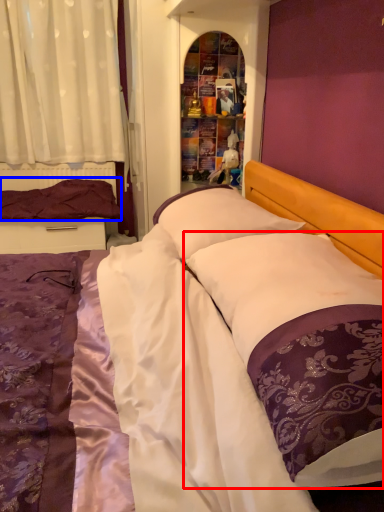
Question: Which point is closer to the camera, pillow (highlighted by a red box) or pillow (highlighted by a blue box)?

Choices:
 (A) pillow
 (B) pillow

Answer: (A)